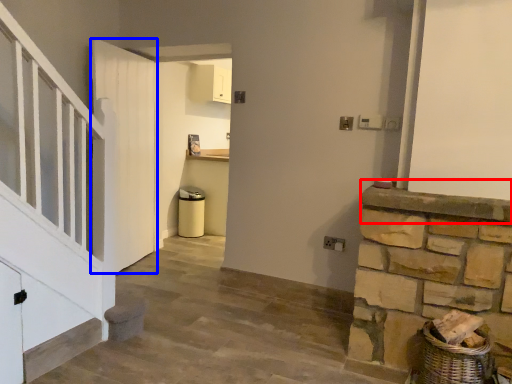
Question: Which of the following is the closest to the observer, mantle (highlighted by a red box) or door (highlighted by a blue box)?

Choices:
 (A) mantle
 (B) door

Answer: (A)